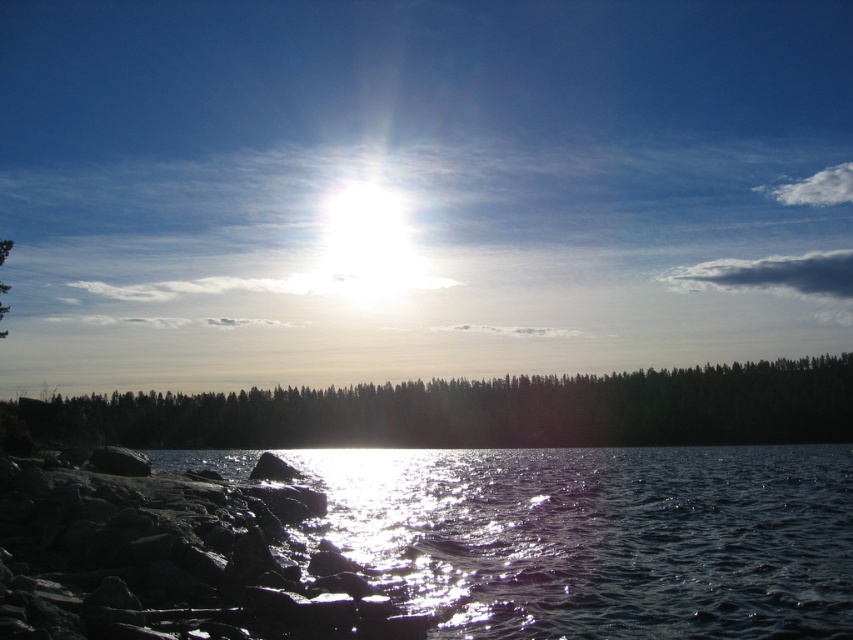
Question: Can you confirm if smooth gray rock at lower left is positioned to the right of dark green forest at center?

Choices:
 (A) yes
 (B) no

Answer: (A)

Question: Estimate the real-world distances between objects in this image. Which object is farther from the dark green forest at center?

Choices:
 (A) glistening water at lower left
 (B) green matte tree at left
 (C) smooth gray rock at lower left

Answer: (B)

Question: Is the position of glistening water at lower left less distant than that of green matte tree at left?

Choices:
 (A) yes
 (B) no

Answer: (A)

Question: Considering the real-world distances, which object is closest to the dark green forest at center?

Choices:
 (A) glistening water at lower left
 (B) green matte tree at left
 (C) smooth gray rock at lower left

Answer: (A)

Question: Does glistening water at lower left have a smaller size compared to smooth gray rock at lower left?

Choices:
 (A) no
 (B) yes

Answer: (A)

Question: Which point appears closest to the camera in this image?

Choices:
 (A) (26, 628)
 (B) (4, 291)
 (C) (476, 406)
 (D) (445, 474)

Answer: (A)